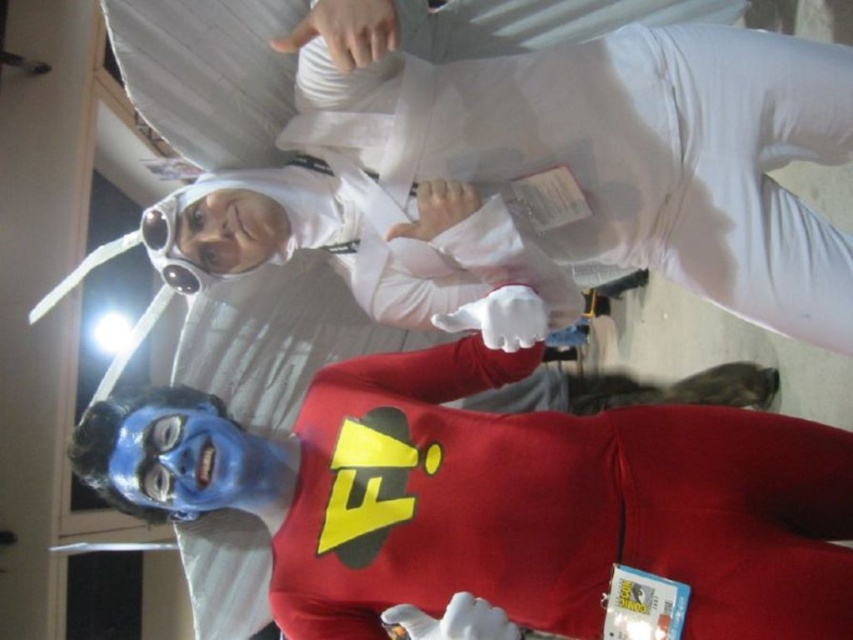
You are a costume designer preparing for a character fitting. You need to ensure that the blue matte face paint at lower left and the matte plastic goggles at upper left are proportionate to each other. Given their sizes, which one should you adjust to make them more balanced?

The blue matte face paint at lower left has a larger size compared to the matte plastic goggles at upper left. To balance them, you should consider reducing the size of the blue matte face paint at lower left or increasing the size of the matte plastic goggles at upper left.

You are a photographer at a convention. You want to take a closeup shot of the blue matte face paint at lower left but also want to ensure the person holding the small object in their left hand is in focus. Can you achieve both with your current camera settings?

The blue matte face paint at lower left is 3.83 feet away from camera. Since the person holding the small object in their left hand is likely closer than 3.83 feet, adjusting the focus to the face paint may blur the hand. Use a smaller aperture for a deeper depth of field to keep both in focus.

You are a photographer at the event and want to capture a closeup of the blue matte face paint at lower left. Based on its position, where should you aim your camera?

The blue matte face paint at lower left is located at point 0.780 on the x axis and 0.589 on the y axis, so aim your camera towards those coordinates.